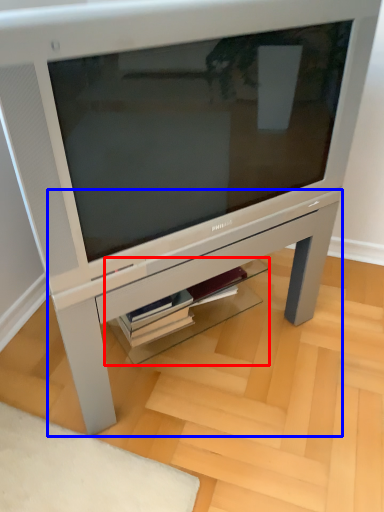
Question: Which object is further to the camera taking this photo, shelf (highlighted by a red box) or table (highlighted by a blue box)?

Choices:
 (A) shelf
 (B) table

Answer: (A)